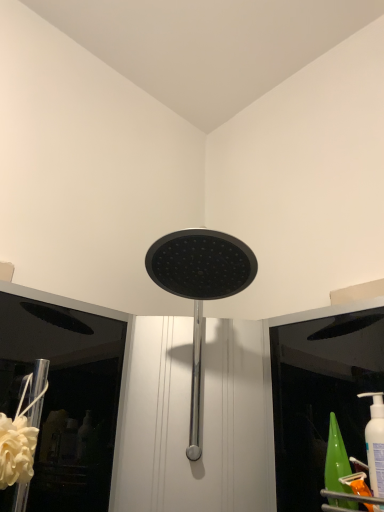
Question: Is white matte flower at lower left taller than black matte shower head at center?

Choices:
 (A) no
 (B) yes

Answer: (A)

Question: Is white matte flower at lower left aimed at black matte shower head at center?

Choices:
 (A) yes
 (B) no

Answer: (B)

Question: From a real-world perspective, does white matte flower at lower left sit lower than black matte shower head at center?

Choices:
 (A) no
 (B) yes

Answer: (B)

Question: Is white matte flower at lower left further to camera compared to black matte shower head at center?

Choices:
 (A) no
 (B) yes

Answer: (B)

Question: Is white matte flower at lower left smaller than black matte shower head at center?

Choices:
 (A) no
 (B) yes

Answer: (B)

Question: Considering the relative positions of white matte flower at lower left and black matte shower head at center in the image provided, is white matte flower at lower left to the right of black matte shower head at center from the viewer's perspective?

Choices:
 (A) no
 (B) yes

Answer: (A)

Question: From a real-world perspective, is black matte shower head at center beneath white matte flower at lower left?

Choices:
 (A) yes
 (B) no

Answer: (B)

Question: Is black matte shower head at center behind white matte flower at lower left?

Choices:
 (A) no
 (B) yes

Answer: (A)

Question: From a real-world perspective, is black matte shower head at center over white matte flower at lower left?

Choices:
 (A) no
 (B) yes

Answer: (B)

Question: Is black matte shower head at center surrounding white matte flower at lower left?

Choices:
 (A) yes
 (B) no

Answer: (B)

Question: Is black matte shower head at center oriented towards white matte flower at lower left?

Choices:
 (A) yes
 (B) no

Answer: (B)

Question: Is black matte shower head at center in front of white matte flower at lower left?

Choices:
 (A) no
 (B) yes

Answer: (B)

Question: From a real-world perspective, relative to white matte flower at lower left, is black matte shower head at center vertically above or below?

Choices:
 (A) below
 (B) above

Answer: (B)